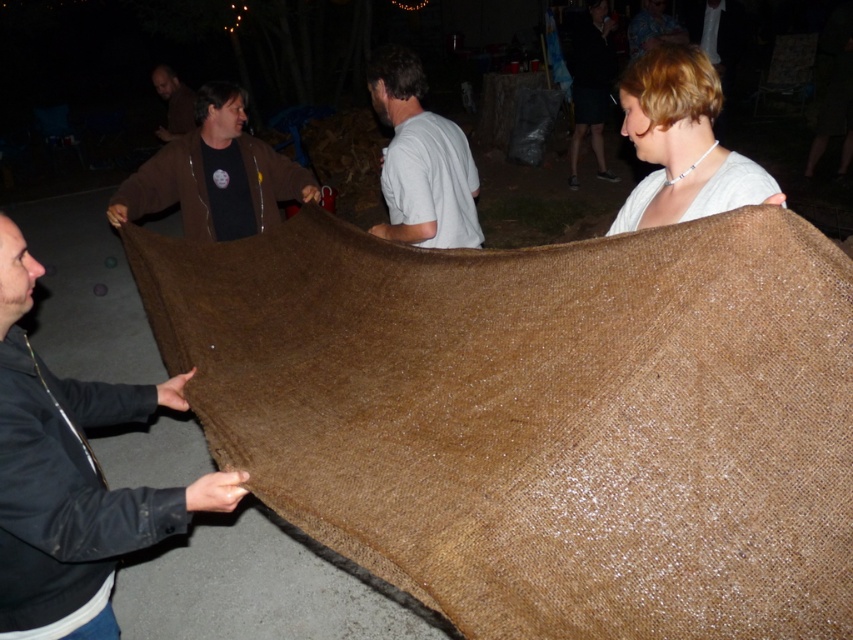
Question: Which is farther from the brown woolen blanket at left?

Choices:
 (A) brown fuzzy sweater at upper center
 (B) matte brown skirt at upper right
 (C) light brown fabric at upper right
 (D) white matte shirt at center

Answer: (B)

Question: Does white matte shirt at center have a smaller size compared to brown fabric at upper left?

Choices:
 (A) no
 (B) yes

Answer: (A)

Question: Is brown woolen blanket at left bigger than matte brown skirt at upper right?

Choices:
 (A) yes
 (B) no

Answer: (B)

Question: Is white matte shirt at center closer to camera compared to brown fabric at upper left?

Choices:
 (A) yes
 (B) no

Answer: (A)

Question: Which object is closer to the camera taking this photo?

Choices:
 (A) shiny gold hair at upper center
 (B) brown fuzzy sweater at upper center

Answer: (B)

Question: Which is nearer to the matte brown skirt at upper right?

Choices:
 (A) white matte shirt at center
 (B) brown woven fabric at center

Answer: (A)